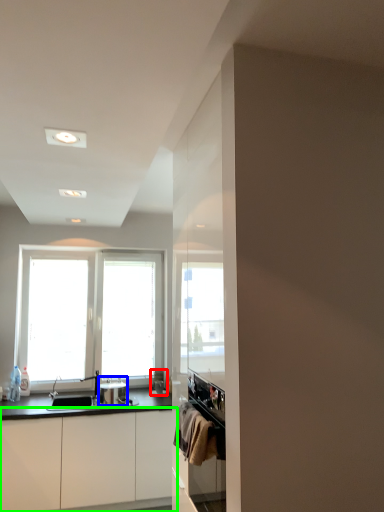
Question: Considering the real-world distances, which object is farthest from appliance (highlighted by a red box)? appliance (highlighted by a blue box) or cabinetry (highlighted by a green box)?

Choices:
 (A) appliance
 (B) cabinetry

Answer: (B)